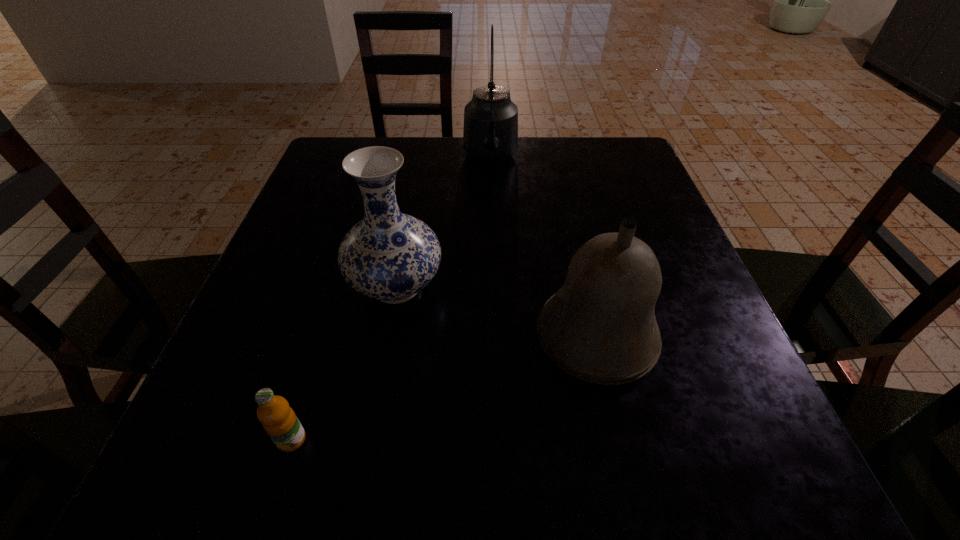
You are a GUI agent. You are given a task and a screenshot of the screen. Output one action in this format:
    pyautogui.click(x=<x>, y=<y>)
    Task: Click on the vase positioned at the left edge
    This screenshot has width=960, height=540.
    Given the screenshot: What is the action you would take?
    pyautogui.click(x=389, y=256)

This screenshot has height=540, width=960. Find the location of `orange juice at the left edge`. orange juice at the left edge is located at coordinates (279, 420).

In order to click on object that is positioned at the right edge in this screenshot , I will do `click(600, 327)`.

Find the location of a particular element. The width and height of the screenshot is (960, 540). object present at the near left corner is located at coordinates (279, 420).

You are a GUI agent. You are given a task and a screenshot of the screen. Output one action in this format:
    pyautogui.click(x=<x>, y=<y>)
    Task: Click on the free location at the far edge of the desktop
    
    Given the screenshot: What is the action you would take?
    pyautogui.click(x=449, y=140)

Image resolution: width=960 pixels, height=540 pixels. Find the location of `vacant space at the near edge`. vacant space at the near edge is located at coordinates (363, 495).

Locate an element on the screen. This screenshot has height=540, width=960. vacant region at the left edge of the desktop is located at coordinates (270, 291).

At what (x,y) coordinates should I click in order to perform the action: click on vacant space at the right edge of the desktop. Please return your answer as a coordinate pair (x, y). This screenshot has width=960, height=540. Looking at the image, I should click on (689, 354).

The height and width of the screenshot is (540, 960). What are the coordinates of `vacant space at the far right corner of the desktop` in the screenshot? It's located at pos(581,145).

Where is `unoccupied position between the bell and the kettle`? unoccupied position between the bell and the kettle is located at coordinates (543, 248).